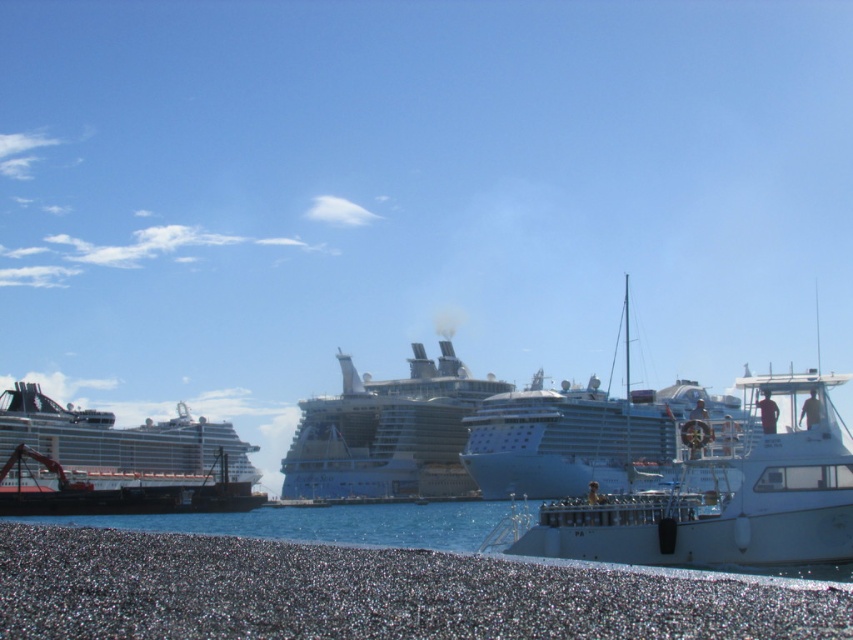
Question: Can you confirm if smooth pebbles at lower left is positioned above white glossy cruise ship at left?

Choices:
 (A) yes
 (B) no

Answer: (A)

Question: Does white glossy cruise ship at left appear on the left side of silver metallic cruise ship at center?

Choices:
 (A) no
 (B) yes

Answer: (B)

Question: Which of the following is the closest to the observer?

Choices:
 (A) white glossy cruise ship at left
 (B) silver metallic cruise ship at center

Answer: (A)

Question: Is smooth pebbles at lower left to the left of white glossy cruise ship at left from the viewer's perspective?

Choices:
 (A) no
 (B) yes

Answer: (A)

Question: Which of the following is the closest to the observer?

Choices:
 (A) smooth pebbles at lower left
 (B) white glossy cruise ship at center

Answer: (A)

Question: Considering the real-world distances, which object is closest to the silver metallic cruise ship at center?

Choices:
 (A) smooth pebbles at lower left
 (B) white glossy cruise ship at center

Answer: (B)